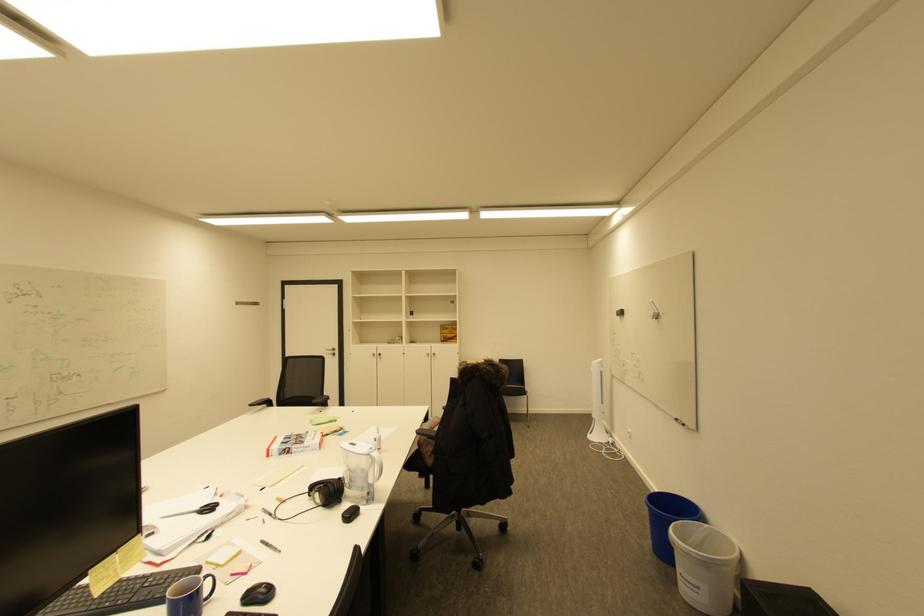
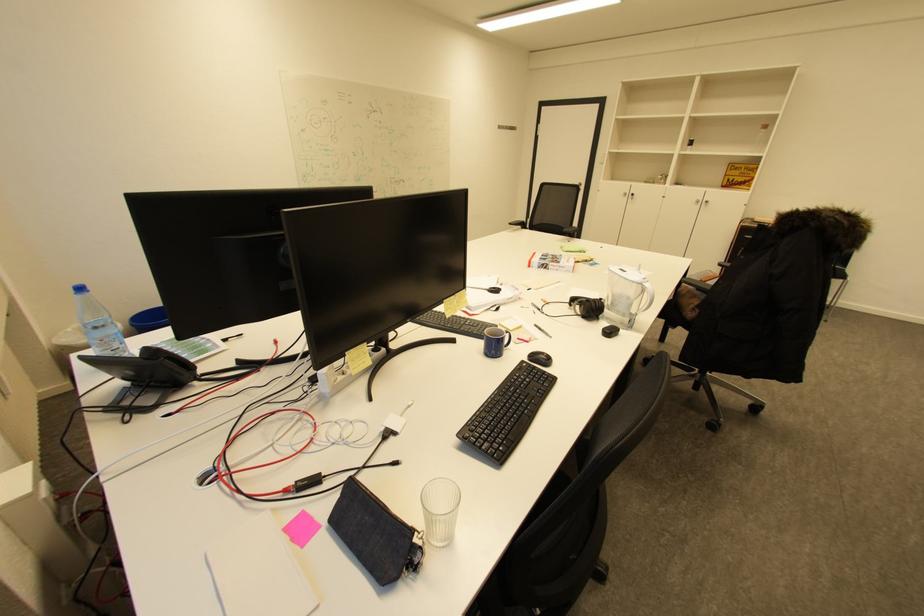
The point at (434, 355) is marked in the first image. Where is the corresponding point in the second image?

(703, 201)